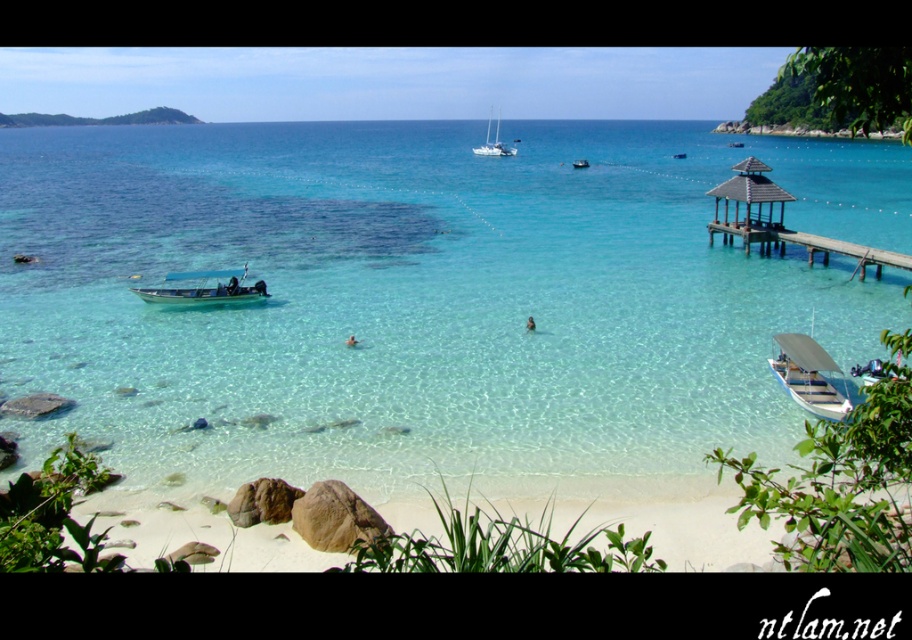
Who is positioned more to the left, white wooden boat at lower right or wooden gazebo at center-right?

From the viewer's perspective, white wooden boat at lower right appears more on the left side.

Measure the distance between point (820, 385) and camera.

Point (820, 385) and camera are 21.96 meters apart from each other.

Find the location of a particular element. The image size is (912, 640). white wooden boat at lower right is located at coordinates (807, 376).

From the picture: Does brown wooden pier at upper right appear on the right side of white wooden boat at lower right?

Correct, you'll find brown wooden pier at upper right to the right of white wooden boat at lower right.

Describe the element at coordinates (781, 221) in the screenshot. I see `brown wooden pier at upper right` at that location.

Identify the location of brown wooden pier at upper right. (781, 221).

Who is higher up, clear crystal water at center or wooden gazebo at center-right?

clear crystal water at center is above.

In order to click on clear crystal water at center in this screenshot , I will do `click(425, 298)`.

This screenshot has height=640, width=912. Find the location of `clear crystal water at center`. clear crystal water at center is located at coordinates (425, 298).